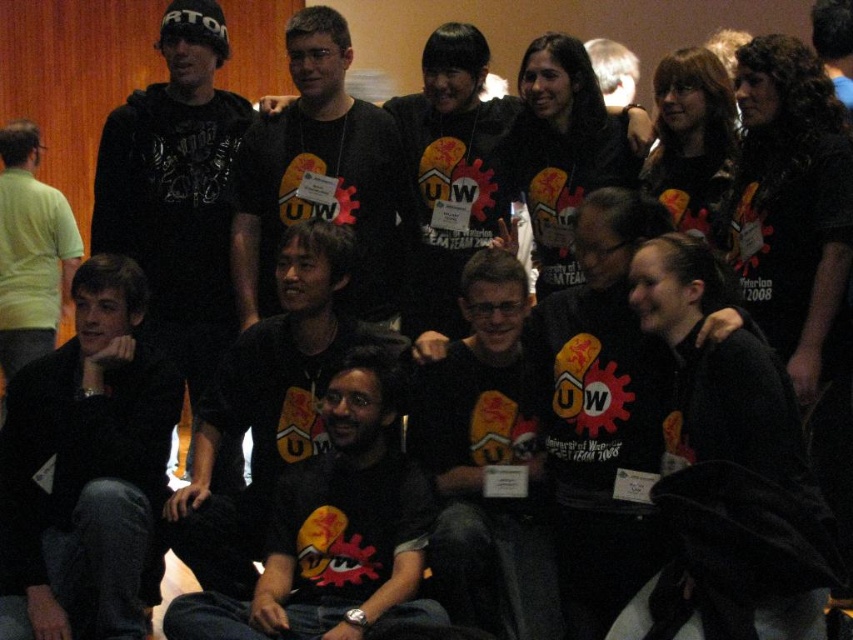
Is black matte shirt at lower left to the left of matte black t-shirt at center from the viewer's perspective?

Indeed, black matte shirt at lower left is positioned on the left side of matte black t-shirt at center.

Where is `black matte shirt at lower left`? black matte shirt at lower left is located at coordinates (90, 465).

Does matte black shirt at center have a lesser width compared to light green shirt at left?

No, matte black shirt at center is not thinner than light green shirt at left.

Locate an element on the screen. matte black shirt at center is located at coordinates (486, 458).

Does black matte t-shirt at center have a lesser height compared to light green shirt at left?

Indeed, black matte t-shirt at center has a lesser height compared to light green shirt at left.

Which is more to the right, black matte t-shirt at center or light green shirt at left?

From the viewer's perspective, black matte t-shirt at center appears more on the right side.

The height and width of the screenshot is (640, 853). In order to click on black matte t-shirt at center in this screenshot , I will do `click(318, 173)`.